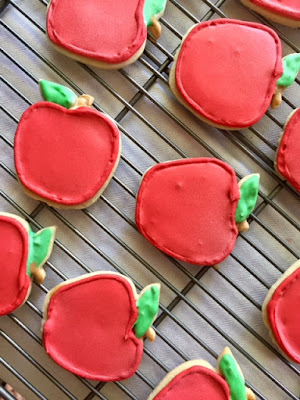
Where is `lighting from sun or lights`? This screenshot has height=400, width=300. lighting from sun or lights is located at coordinates (196, 361).